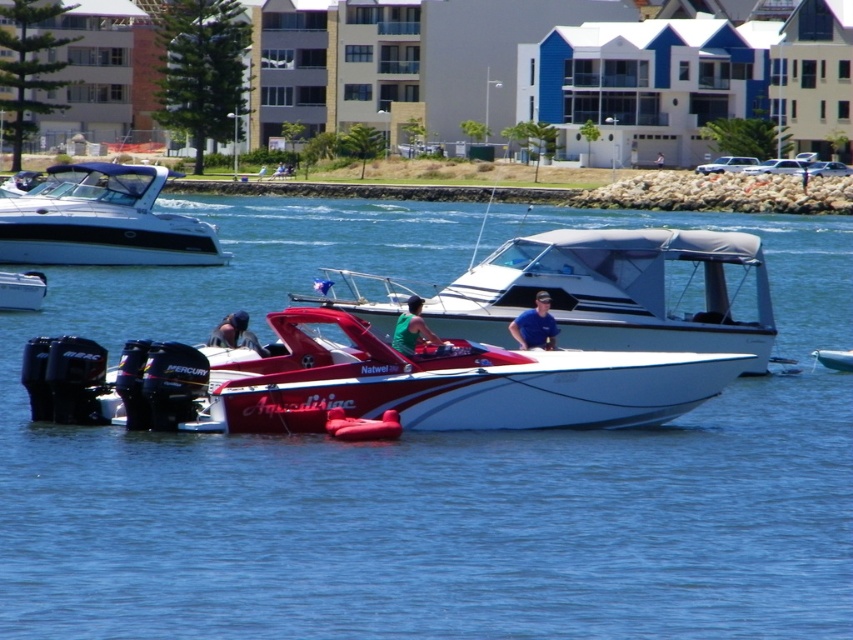
Question: Considering the real-world distances, which object is closest to the white glossy water at center?

Choices:
 (A) white glossy dinghy at lower right
 (B) green matte shirt at center
 (C) metallic silver boat at lower left

Answer: (B)

Question: Is green matte shirt at center bigger than matte black helmet at lower left?

Choices:
 (A) no
 (B) yes

Answer: (A)

Question: Observing the image, what is the correct spatial positioning of white glossy motorboat at upper left in reference to metallic silver boat at lower left?

Choices:
 (A) right
 (B) left

Answer: (B)

Question: Among these points, which one is farthest from the camera?

Choices:
 (A) (247, 340)
 (B) (831, 330)

Answer: (B)

Question: Is white glossy water at center below matte black helmet at lower left?

Choices:
 (A) yes
 (B) no

Answer: (B)

Question: Which point is closer to the camera taking this photo?

Choices:
 (A) (25, 275)
 (B) (410, 352)

Answer: (B)